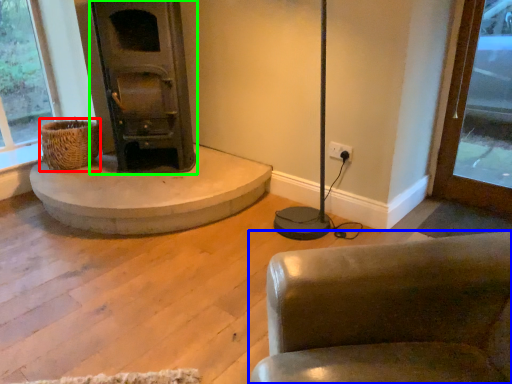
Question: Which is farther away from basket (highlighted by a red box)? chair (highlighted by a blue box) or wood burning stove (highlighted by a green box)?

Choices:
 (A) chair
 (B) wood burning stove

Answer: (A)